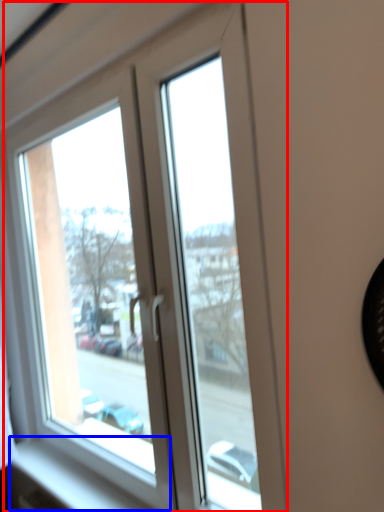
Question: Which object is closer to the camera taking this photo, window (highlighted by a red box) or window sill (highlighted by a blue box)?

Choices:
 (A) window
 (B) window sill

Answer: (A)